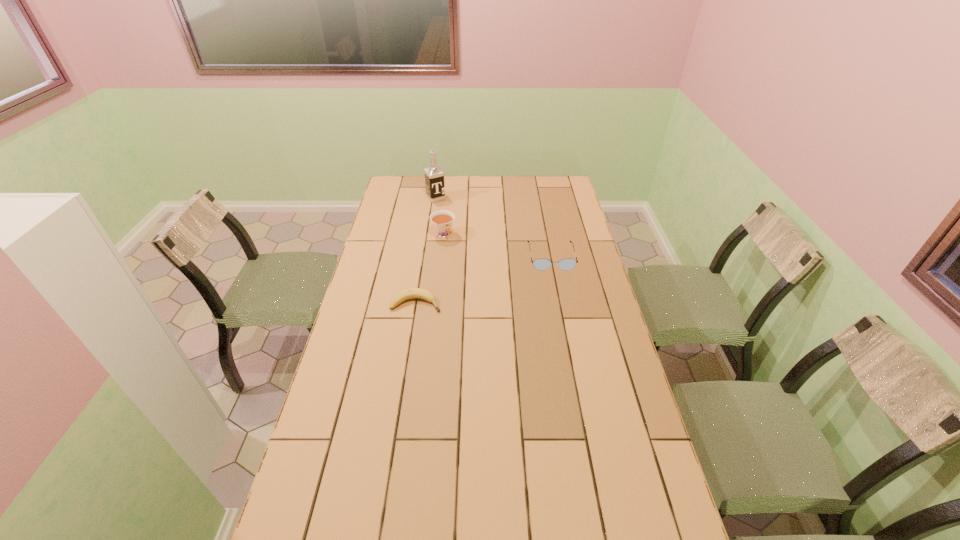
What are the coordinates of `vacant space that's between the tallest object and the rightmost object` in the screenshot? It's located at (493, 227).

Identify the location of unoccupied position between the spectacles and the shortest object. (484, 280).

I want to click on object that can be found as the closest to the nearest object, so click(x=442, y=220).

Locate which object ranks third in proximity to the banana. Please provide its 2D coordinates. Your answer should be formatted as a tuple, i.e. [(x, y)], where the tuple contains the x and y coordinates of a point satisfying the conditions above.

[(434, 176)]